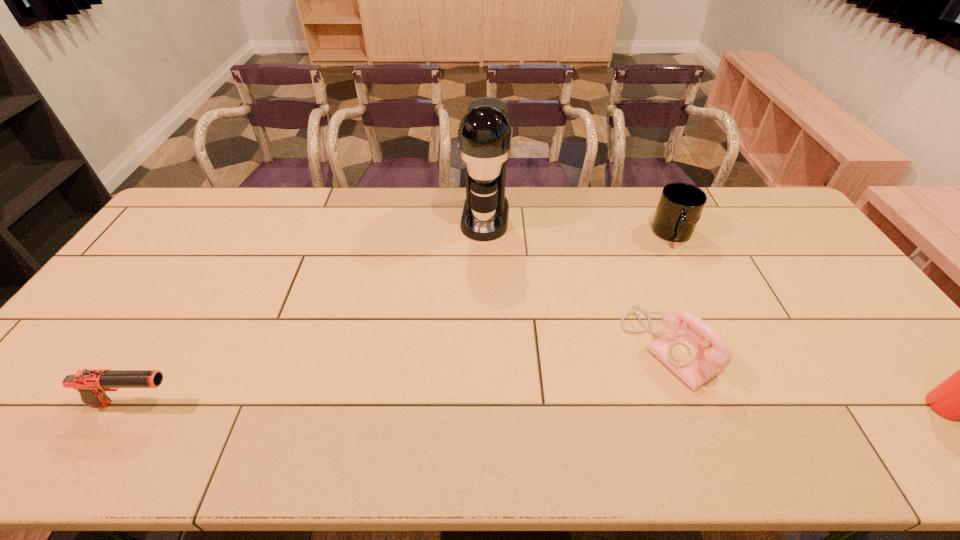
Locate an element on the screen. the leftmost object is located at coordinates (91, 384).

You are a GUI agent. You are given a task and a screenshot of the screen. Output one action in this format:
    pyautogui.click(x=<x>, y=<y>)
    Task: Click on the coffee maker
    The height and width of the screenshot is (540, 960).
    Given the screenshot: What is the action you would take?
    pyautogui.click(x=485, y=133)

Identify the location of the fourth object from right to left. (485, 133).

At what (x,y) coordinates should I click in order to perform the action: click on the third nearest object. Please return your answer as a coordinate pair (x, y). The height and width of the screenshot is (540, 960). Looking at the image, I should click on (687, 349).

The height and width of the screenshot is (540, 960). I want to click on mug, so click(680, 206).

Identify the location of free space located 0.220m at the aiming end of the leftmost object. (274, 403).

This screenshot has height=540, width=960. Identify the location of free space located place cup under the spout of the coffee maker. (478, 273).

The width and height of the screenshot is (960, 540). What are the coordinates of `vacant space located 0.380m place cup under the spout of the coffee maker` in the screenshot? It's located at (469, 333).

This screenshot has height=540, width=960. What are the coordinates of `free space located place cup under the spout of the coffee maker` in the screenshot? It's located at (475, 295).

You are a GUI agent. You are given a task and a screenshot of the screen. Output one action in this format:
    pyautogui.click(x=<x>, y=<y>)
    Task: Click on the vacant point located on the dial of the third farthest object
    The image size is (960, 540).
    Given the screenshot: What is the action you would take?
    pyautogui.click(x=617, y=386)